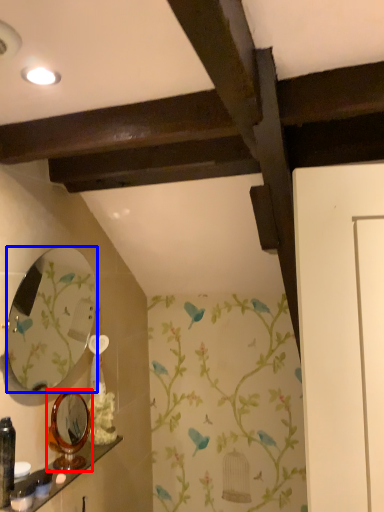
Question: Which point is closer to the camera, mirror (highlighted by a red box) or mirror (highlighted by a blue box)?

Choices:
 (A) mirror
 (B) mirror

Answer: (B)